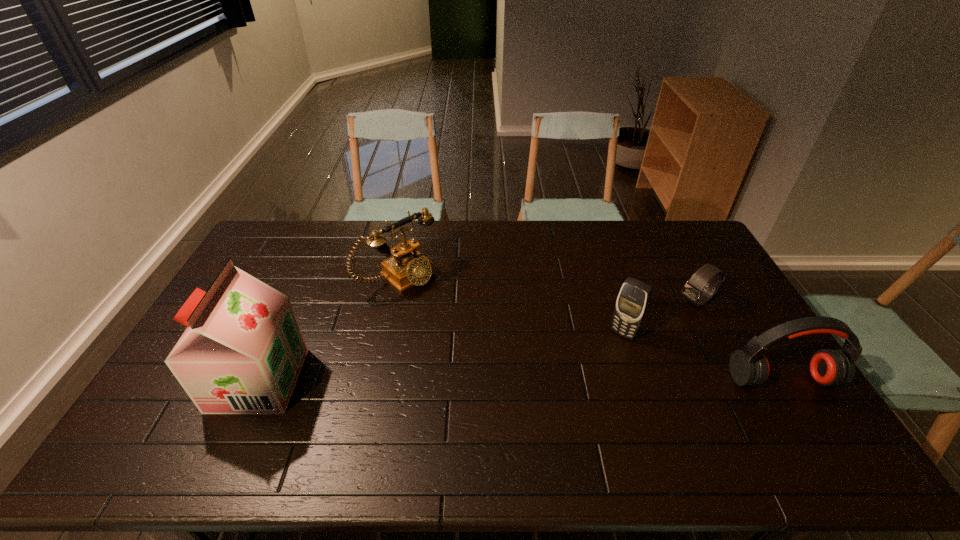
Find the location of `free spot between the telephone and the earphone`. free spot between the telephone and the earphone is located at coordinates (590, 328).

Identify the location of object that is the third closest one to the leftmost object. (693, 292).

I want to click on object that is the closest to the telephone, so click(x=242, y=352).

Locate an element on the screen. The image size is (960, 540). vacant space that satisfies the following two spatial constraints: 1. on the back side of the watch; 2. on the right side of the cellular telephone is located at coordinates (613, 301).

I want to click on free location that satisfies the following two spatial constraints: 1. on the front side of the fourth object from right to left; 2. on the right side of the third nearest object, so click(x=386, y=333).